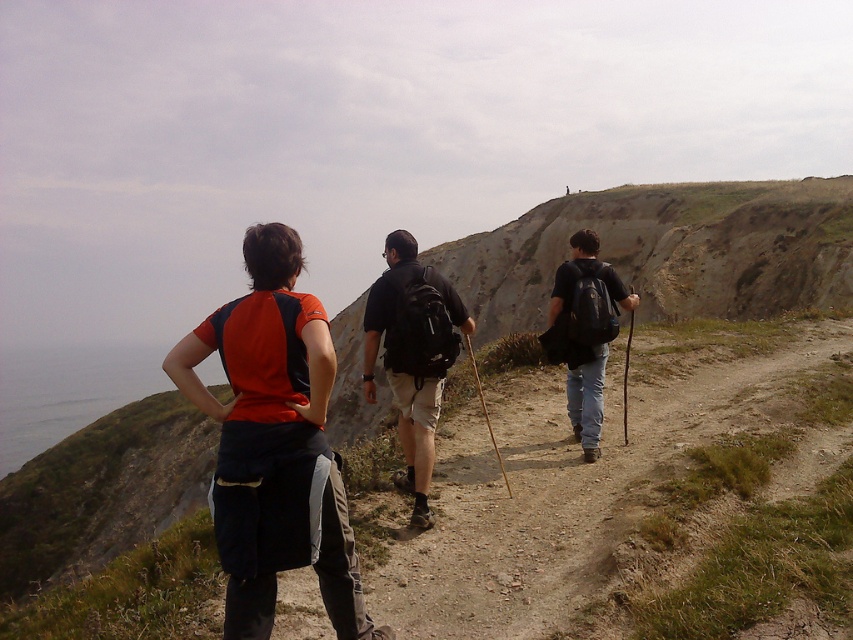
Does point (358, 611) lie in front of point (433, 394)?

Yes, it is.

How much distance is there between matte orange shirt at center and matte black backpack at center?

A distance of 1.86 meters exists between matte orange shirt at center and matte black backpack at center.

Which is in front, point (248, 531) or point (424, 298)?

Point (248, 531) is in front.

Image resolution: width=853 pixels, height=640 pixels. I want to click on matte orange shirt at center, so click(x=274, y=444).